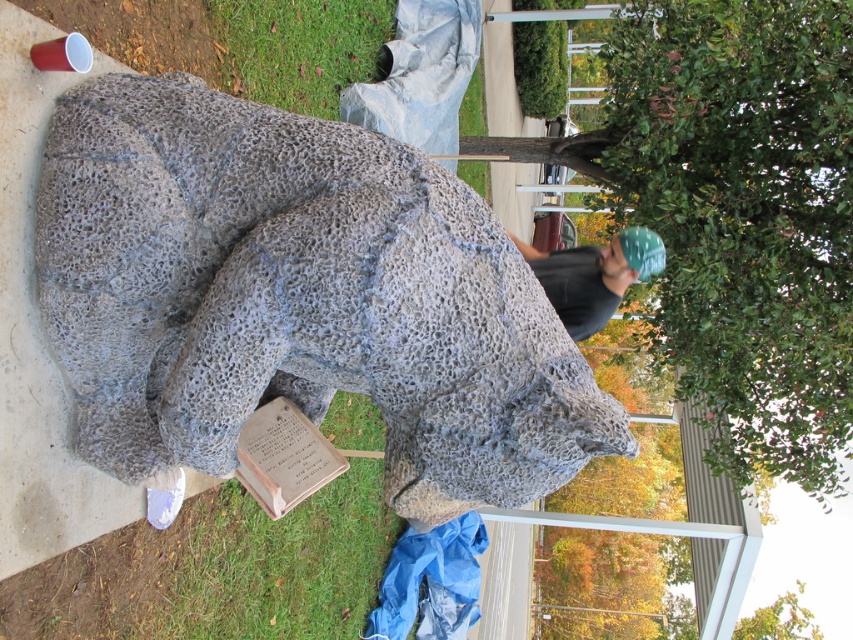
You are standing at the center of the image and want to place a small decorative rock exactly at the green grass at lower center. What are the coordinates where you should place the rock?

The coordinates for the green grass at lower center are at point [279,564].

You are a visitor at an art exhibition and want to take a photo of the gray textured sculpture at center without the brown stone plaque at lower center appearing in the frame. Is this possible based on their positions?

The gray textured sculpture at center is in front of the brown stone plaque at lower center, so if you position yourself so the sculpture is between you and the plaque, the plaque will be obscured by the sculpture in the photo.

You are a gardener who needs to water the green grass at lower center. The brown stone plaque at lower center is in the way. Can you move the plaque to access the grass?

The green grass at lower center is located below the brown stone plaque at lower center, so you cannot move the plaque to access the grass since the grass is already underneath it.